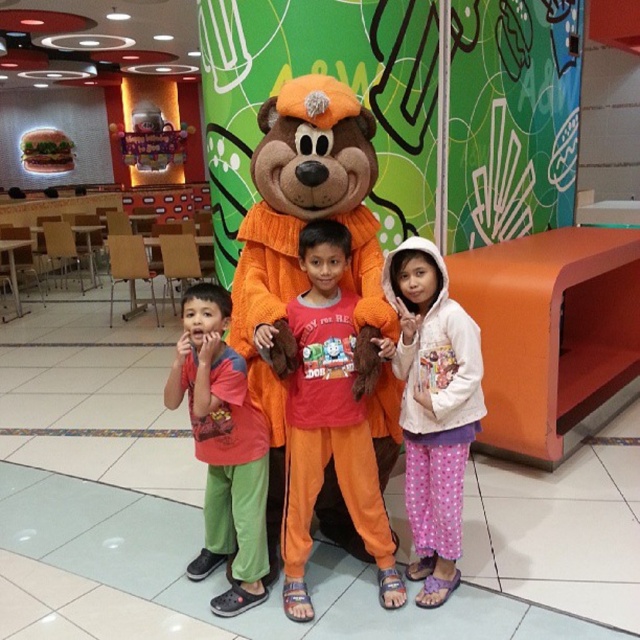
Which is more to the right, white fleece hoodie at center or red-orange t-shirt at center?

white fleece hoodie at center

You are a GUI agent. You are given a task and a screenshot of the screen. Output one action in this format:
    pyautogui.click(x=<x>, y=<y>)
    Task: Click on the white fleece hoodie at center
    
    Given the screenshot: What is the action you would take?
    pos(433,408)

I want to click on white fleece hoodie at center, so click(433, 408).

Which is more to the left, orange plush toy at center or red-orange t-shirt at center?

Positioned to the left is red-orange t-shirt at center.

Identify the location of orange plush toy at center. (328, 420).

Is orange plush toy at center smaller than white fleece hoodie at center?

No, orange plush toy at center is not smaller than white fleece hoodie at center.

Is orange plush toy at center thinner than white fleece hoodie at center?

In fact, orange plush toy at center might be wider than white fleece hoodie at center.

Does point (401, 580) come farther from viewer compared to point (429, 566)?

No, it is in front of (429, 566).

This screenshot has height=640, width=640. In order to click on orange plush toy at center in this screenshot , I will do `click(328, 420)`.